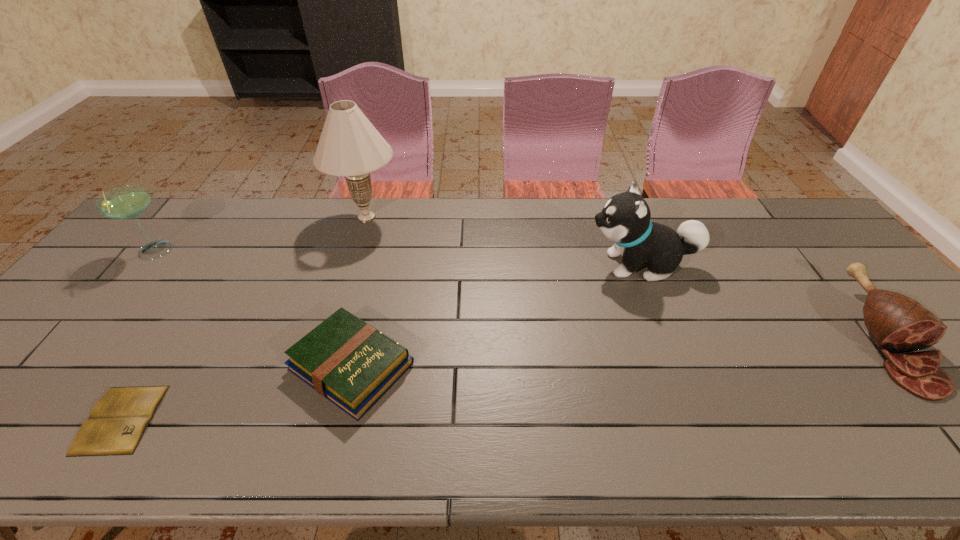
I want to click on vacant space located 0.320m at the face of the fifth object from left to right, so click(x=476, y=265).

Locate an element on the screen. The height and width of the screenshot is (540, 960). vacant point located 0.130m at the face of the fifth object from left to right is located at coordinates (540, 265).

This screenshot has height=540, width=960. Find the location of `vacant area situated at the face of the fifth object from left to right`. vacant area situated at the face of the fifth object from left to right is located at coordinates (567, 265).

Find the location of a particular element. The image size is (960, 540). free location located 0.140m on the right of the fourth shortest object is located at coordinates (222, 251).

Locate an element on the screen. free point located 0.190m on the left of the fifth tallest object is located at coordinates (209, 366).

You are a GUI agent. You are given a task and a screenshot of the screen. Output one action in this format:
    pyautogui.click(x=<x>, y=<y>)
    Task: Click on the vacant space located on the back of the shortest object
    The height and width of the screenshot is (540, 960).
    Given the screenshot: What is the action you would take?
    pyautogui.click(x=171, y=341)

Identify the location of lampshade that is at the far edge. (349, 145).

Find the location of a particular element. martini at the far edge is located at coordinates (127, 202).

Identify the location of object that is at the left edge. (127, 202).

What are the coordinates of `object that is positioned at the far left corner` in the screenshot? It's located at (127, 202).